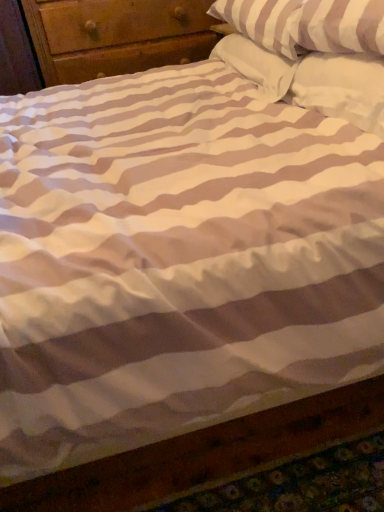
Question: From a real-world perspective, is white striped pillow at upper right, the 2th pillow viewed from the front, located higher than white soft pillow at upper right, the 3th pillow viewed from the front?

Choices:
 (A) no
 (B) yes

Answer: (B)

Question: Can you confirm if white striped pillow at upper right, which is counted as the second pillow, starting from the back, is wider than white soft pillow at upper right, which is the 1th pillow from back to front?

Choices:
 (A) yes
 (B) no

Answer: (A)

Question: Does white striped pillow at upper right, which is counted as the second pillow, starting from the back, appear on the left side of white soft pillow at upper right, the 3th pillow viewed from the front?

Choices:
 (A) no
 (B) yes

Answer: (B)

Question: Considering the relative sizes of white striped pillow at upper right, the 2th pillow viewed from the front, and white soft pillow at upper right, the 3th pillow viewed from the front, in the image provided, is white striped pillow at upper right, the 2th pillow viewed from the front, shorter than white soft pillow at upper right, the 3th pillow viewed from the front,?

Choices:
 (A) yes
 (B) no

Answer: (B)

Question: Is white soft pillow at upper right, the 3th pillow viewed from the front, at the back of white striped pillow at upper right, the 2th pillow viewed from the front?

Choices:
 (A) no
 (B) yes

Answer: (A)

Question: From a real-world perspective, is white striped pillow at upper right, the 2th pillow viewed from the front, physically located above or below white soft pillow at upper right, the 3th pillow in the back-to-front sequence?

Choices:
 (A) below
 (B) above

Answer: (B)

Question: Considering the relative positions of white striped pillow at upper right, which is counted as the second pillow, starting from the back, and white soft pillow at upper right, the 3th pillow in the back-to-front sequence, in the image provided, is white striped pillow at upper right, which is counted as the second pillow, starting from the back, to the left or to the right of white soft pillow at upper right, the 3th pillow in the back-to-front sequence,?

Choices:
 (A) right
 (B) left

Answer: (B)

Question: Is point (273, 12) positioned closer to the camera than point (359, 80)?

Choices:
 (A) closer
 (B) farther

Answer: (B)

Question: Is white striped pillow at upper right, the 2th pillow viewed from the front, wider or thinner than white soft pillow at upper right, the first pillow when ordered from front to back?

Choices:
 (A) thin
 (B) wide

Answer: (B)

Question: In the image, is white soft pillow at upper right, the 3th pillow in the back-to-front sequence, on the left side or the right side of white soft pillow at upper right, the 3th pillow viewed from the front?

Choices:
 (A) left
 (B) right

Answer: (B)

Question: Is white soft pillow at upper right, the 3th pillow in the back-to-front sequence, spatially inside white soft pillow at upper right, which is the 1th pillow from back to front, or outside of it?

Choices:
 (A) inside
 (B) outside

Answer: (B)

Question: Is white soft pillow at upper right, the 3th pillow in the back-to-front sequence, taller or shorter than white soft pillow at upper right, the 3th pillow viewed from the front?

Choices:
 (A) tall
 (B) short

Answer: (A)

Question: From a real-world perspective, is white soft pillow at upper right, the first pillow when ordered from front to back, positioned above or below white soft pillow at upper right, which is the 1th pillow from back to front?

Choices:
 (A) below
 (B) above

Answer: (B)

Question: In terms of height, does white soft pillow at upper right, which is the 1th pillow from back to front, look taller or shorter compared to white striped pillow at upper right, the 2th pillow viewed from the front?

Choices:
 (A) short
 (B) tall

Answer: (A)

Question: In terms of width, does white soft pillow at upper right, which is the 1th pillow from back to front, look wider or thinner when compared to white striped pillow at upper right, which is counted as the second pillow, starting from the back?

Choices:
 (A) wide
 (B) thin

Answer: (B)